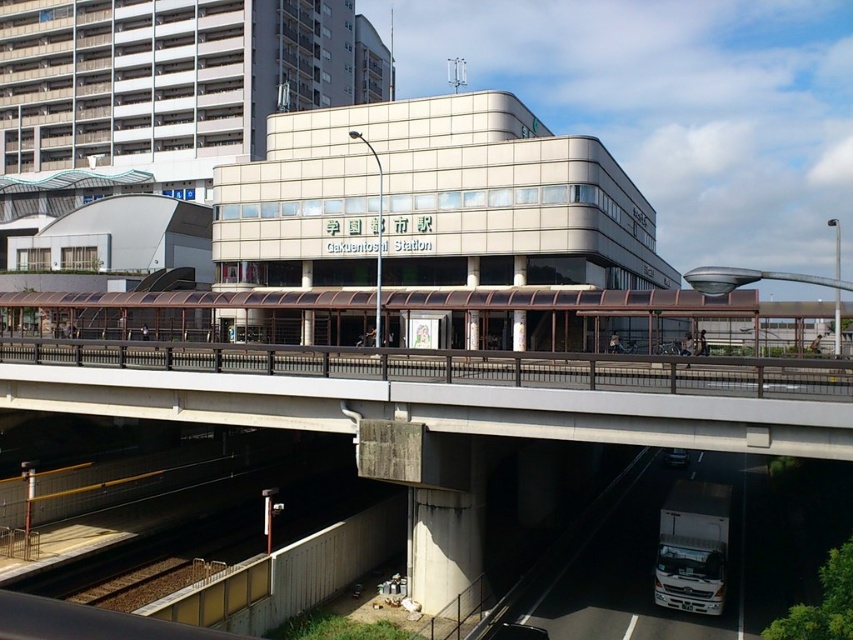
Is white glossy truck at lower right thinner than metallic silver truck at lower center?

Correct, white glossy truck at lower right's width is less than metallic silver truck at lower center's.

Is white glossy truck at lower right positioned behind metallic silver truck at lower center?

Yes, white glossy truck at lower right is further from the viewer.

Is point (666, 541) farther from viewer compared to point (669, 451)?

No, it is not.

At what (x,y) coordinates should I click in order to perform the action: click on white glossy truck at lower right. Please return your answer as a coordinate pair (x, y). Looking at the image, I should click on (692, 547).

Is concrete bridge at center taller than metallic silver truck at lower center?

Incorrect, concrete bridge at center's height is not larger of metallic silver truck at lower center's.

Describe the element at coordinates (445, 392) in the screenshot. I see `concrete bridge at center` at that location.

This screenshot has width=853, height=640. Find the location of `concrete bridge at center`. concrete bridge at center is located at coordinates (445, 392).

Where is `concrete bridge at center`? concrete bridge at center is located at coordinates (445, 392).

Is point (834, 406) more distant than point (672, 534)?

No, (834, 406) is in front of (672, 534).

Who is more forward, (x=683, y=419) or (x=692, y=588)?

Point (x=683, y=419)

Find the location of a particular element. The height and width of the screenshot is (640, 853). concrete bridge at center is located at coordinates (445, 392).